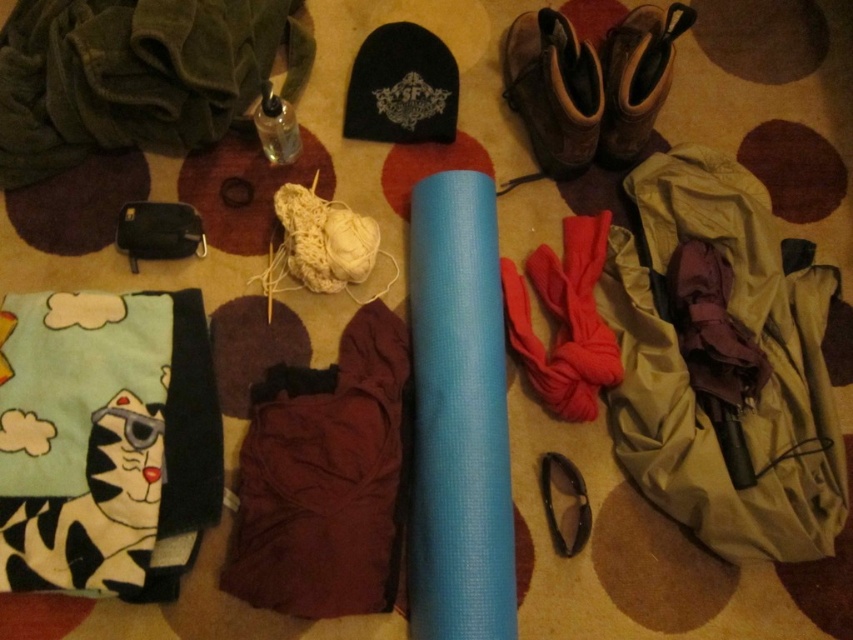
Describe the element at coordinates (326, 477) in the screenshot. I see `burgundy fabric at center` at that location.

What do you see at coordinates (326, 477) in the screenshot? The width and height of the screenshot is (853, 640). I see `burgundy fabric at center` at bounding box center [326, 477].

The width and height of the screenshot is (853, 640). Find the location of `burgundy fabric at center`. burgundy fabric at center is located at coordinates point(326,477).

In the scene shown: Who is positioned more to the right, leather boots at upper right or brown suede boot at upper right?

Positioned to the right is brown suede boot at upper right.

Measure the distance between leather boots at upper right and camera.

leather boots at upper right is 1.19 meters away from camera.

Between point (572, 176) and point (614, 138), which one is positioned behind?

Positioned behind is point (572, 176).

At what (x,y) coordinates should I click in order to perform the action: click on leather boots at upper right. Please return your answer as a coordinate pair (x, y). Image resolution: width=853 pixels, height=640 pixels. Looking at the image, I should click on (553, 90).

Consider the image. Which of these two, burgundy fabric at center or brown suede boot at upper right, stands taller?

burgundy fabric at center

Consider the image. Who is more distant from viewer, (383, 422) or (633, 48)?

Point (633, 48)

Where is `burgundy fabric at center`? burgundy fabric at center is located at coordinates (326, 477).